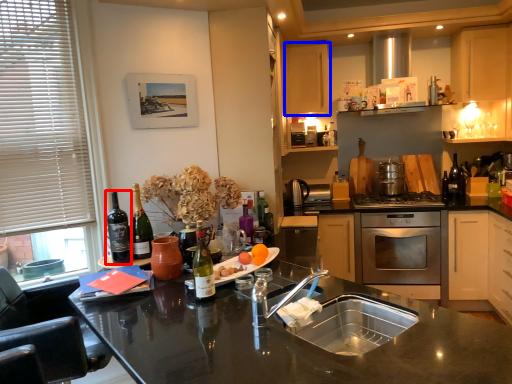
Question: Which object appears closest to the camera in this image, wine (highlighted by a red box) or cabinetry (highlighted by a blue box)?

Choices:
 (A) wine
 (B) cabinetry

Answer: (A)